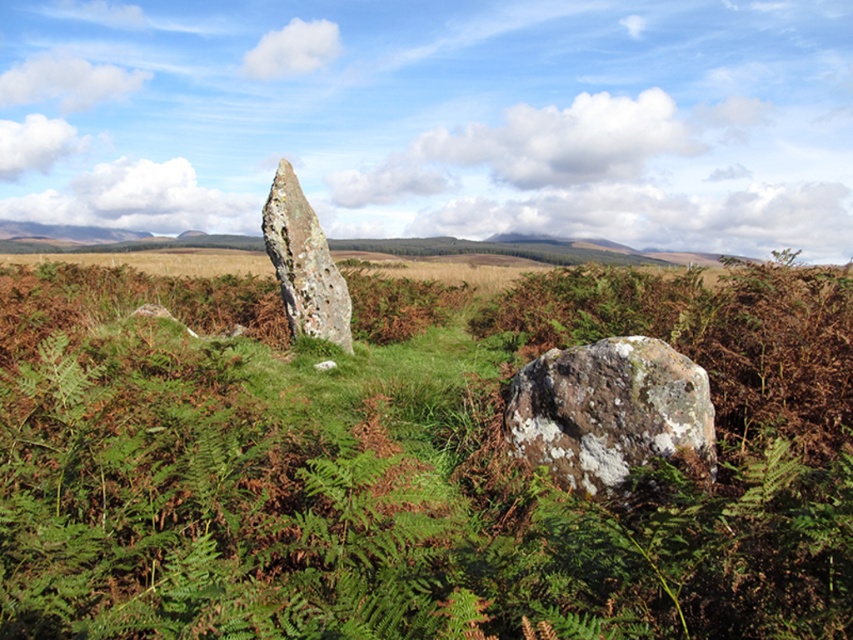
Can you confirm if speckled rock at center is positioned to the right of speckled stone monolith at center?

Yes, speckled rock at center is to the right of speckled stone monolith at center.

What do you see at coordinates (610, 412) in the screenshot? The image size is (853, 640). I see `speckled rock at center` at bounding box center [610, 412].

Which is in front, point (664, 413) or point (285, 262)?

Positioned in front is point (664, 413).

Find the location of a particular element. This screenshot has height=640, width=853. speckled rock at center is located at coordinates (610, 412).